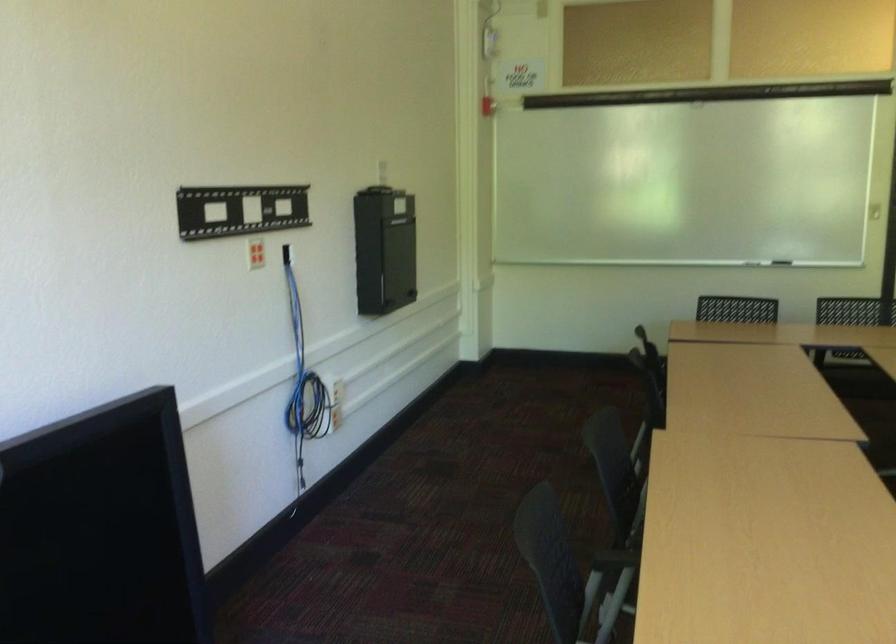
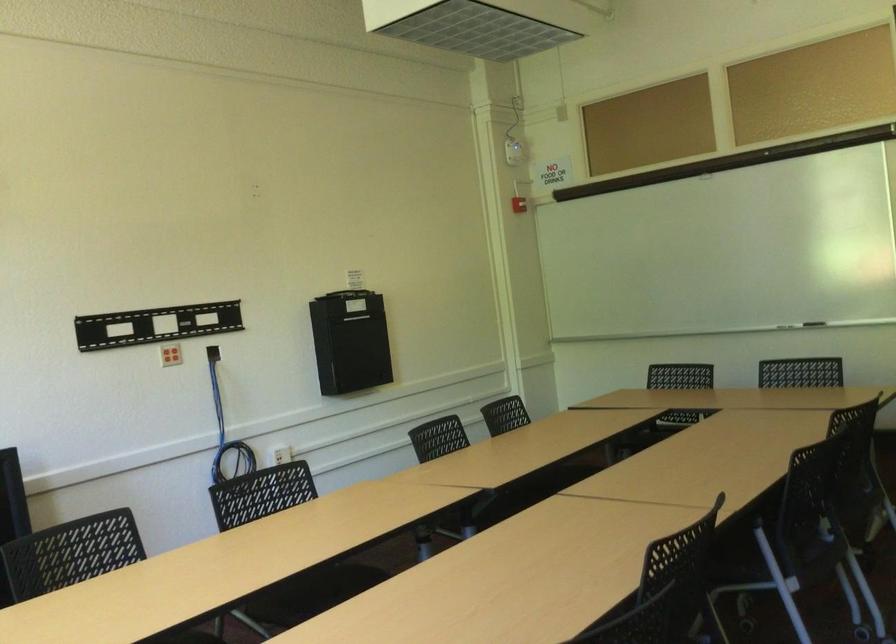
In the second image, find the point that corresponds to the point at 807,247 in the first image.

(814, 323)